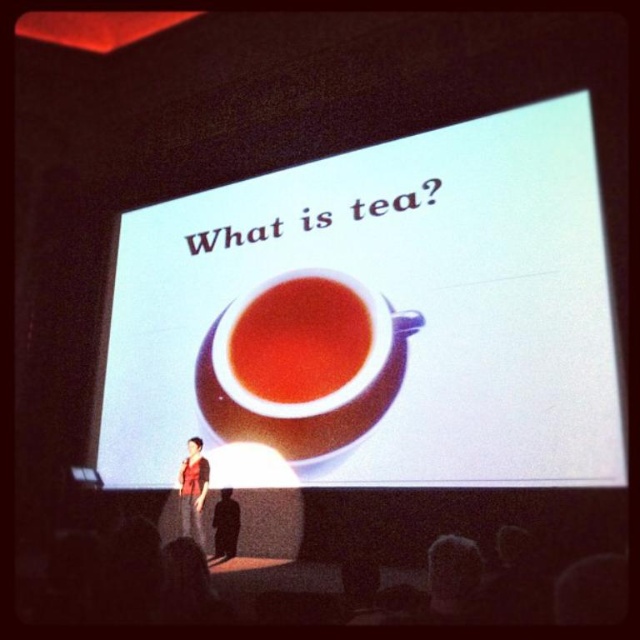
Question: Among these points, which one is nearest to the camera?

Choices:
 (A) (184, 477)
 (B) (230, 548)
 (C) (380, 371)
 (D) (228, 348)

Answer: (C)

Question: Estimate the real-world distances between objects in this image. Which object is closer to the red shirt at center?

Choices:
 (A) matte black shirt at center
 (B) white glossy cup at center
 (C) translucent glass cup at center

Answer: (A)

Question: Which object is closer to the camera taking this photo?

Choices:
 (A) white glossy cup at center
 (B) matte black shirt at center
 (C) translucent glass cup at center
 (D) red shirt at center

Answer: (A)

Question: Where is translucent glass cup at center located in relation to red shirt at center in the image?

Choices:
 (A) above
 (B) below

Answer: (A)

Question: Is white glossy cup at center smaller than red shirt at center?

Choices:
 (A) yes
 (B) no

Answer: (B)

Question: Does translucent glass cup at center come in front of matte black shirt at center?

Choices:
 (A) no
 (B) yes

Answer: (B)